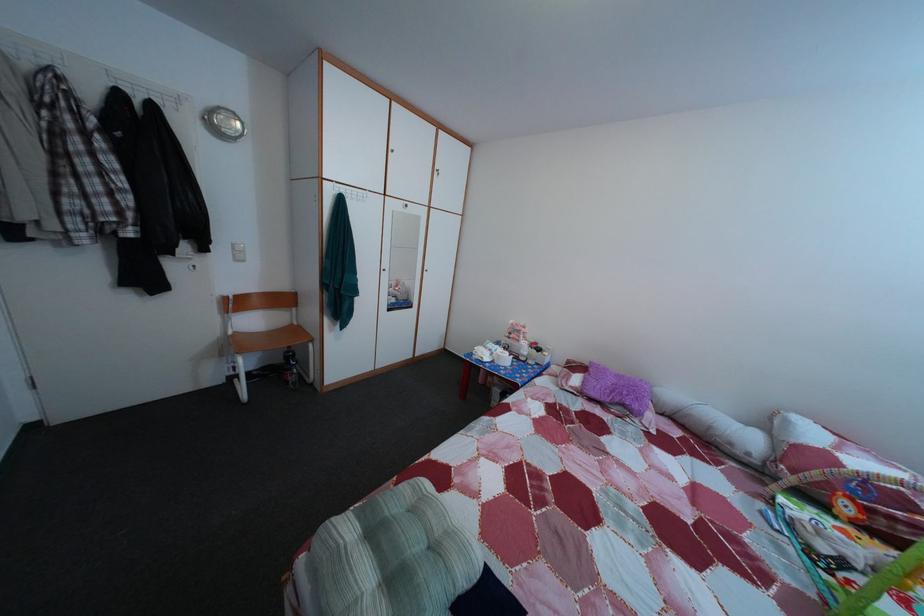
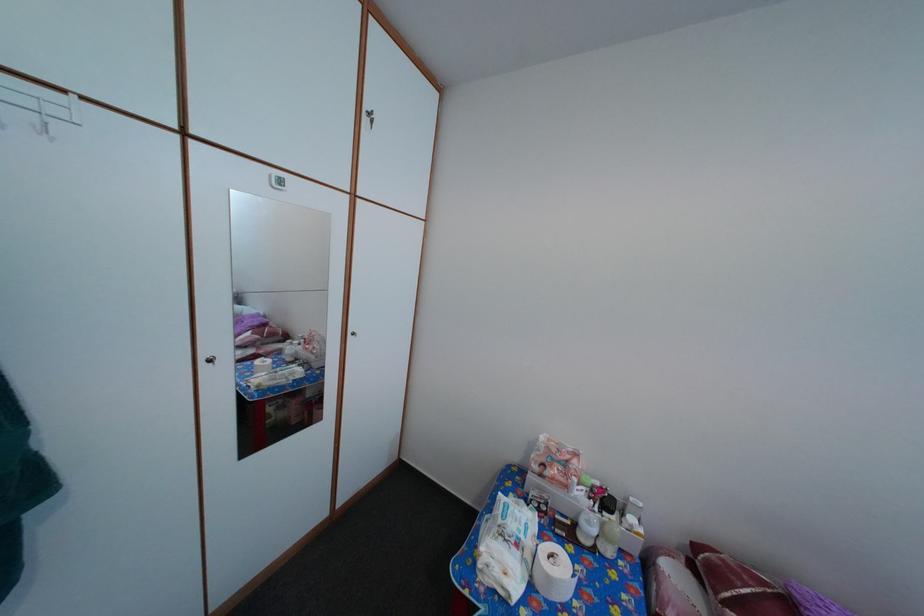
The point at (507,363) is marked in the first image. Where is the corresponding point in the second image?

(558, 586)